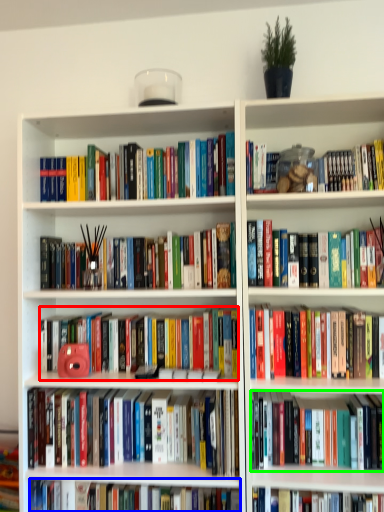
Question: Which object is the farthest from book (highlighted by a red box)? Choose among these: book (highlighted by a blue box) or book (highlighted by a green box).

Choices:
 (A) book
 (B) book

Answer: (A)